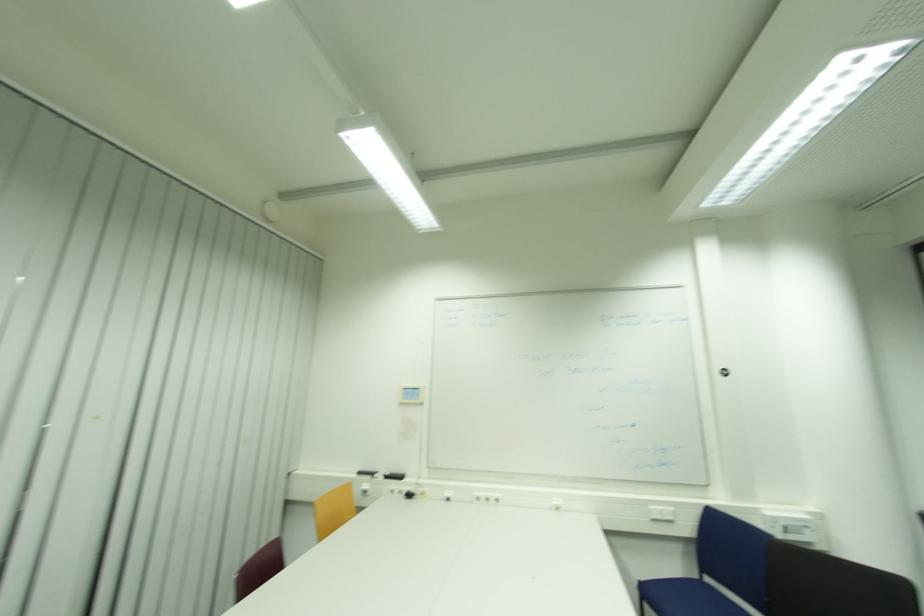
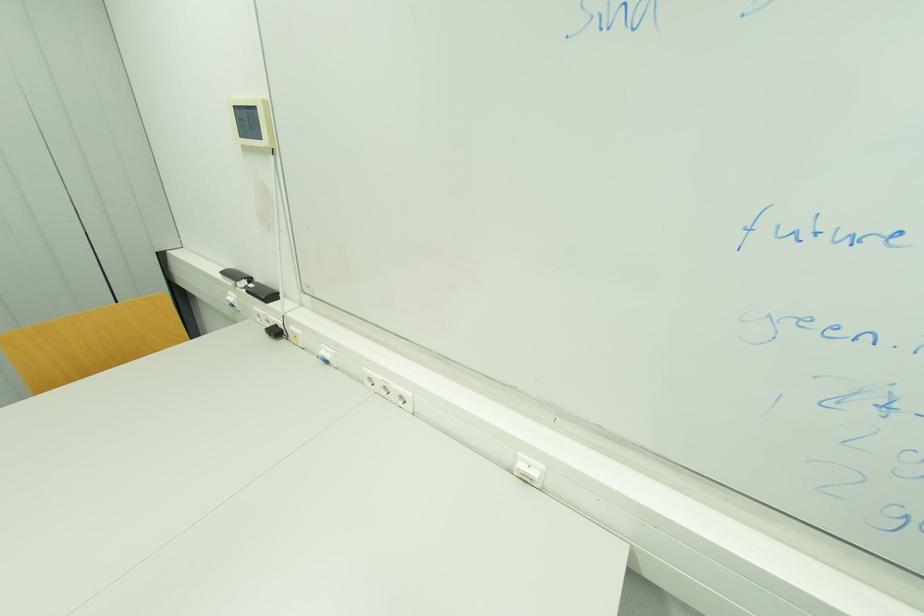
Where in the second image is the point corresponding to point (414, 496) from the first image?

(281, 333)